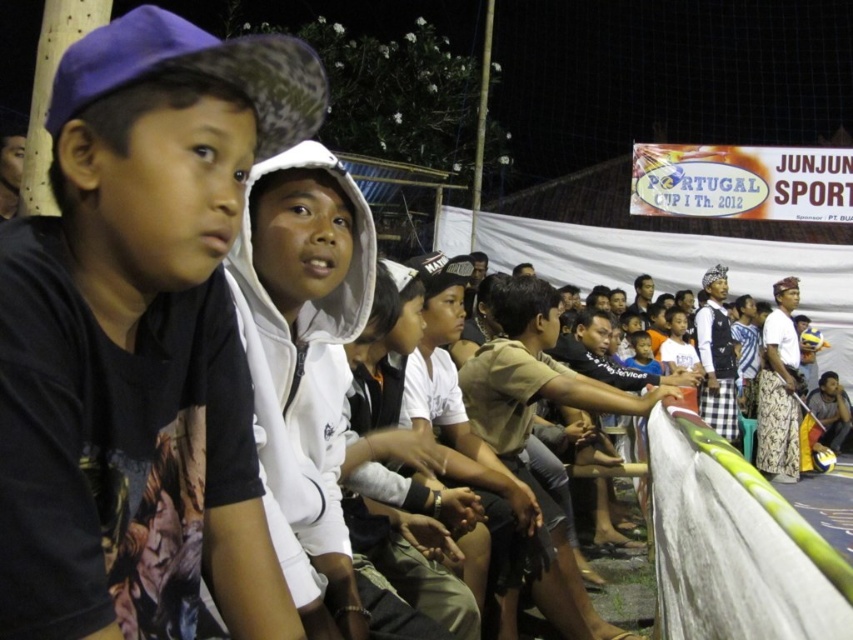
Can you confirm if black matte t-shirt at left is thinner than white fleece jacket at center?

Yes.

Is point (64, 400) behind point (328, 387)?

That is False.

Locate an element on the screen. black matte t-shirt at left is located at coordinates coord(141,340).